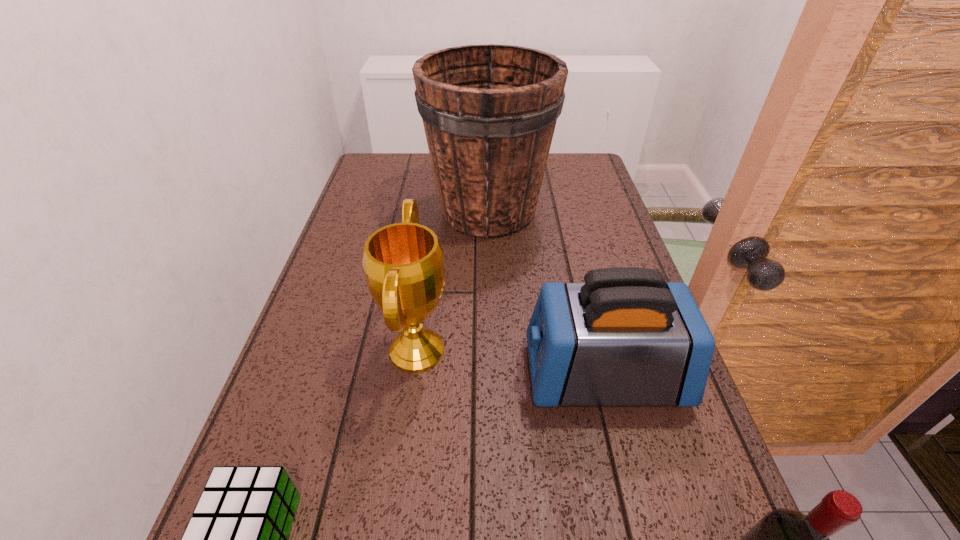
Locate an element on the screen. Image resolution: width=960 pixels, height=540 pixels. object located in the right edge section of the desktop is located at coordinates (626, 337).

Locate an element on the screen. vacant space at the left edge of the desktop is located at coordinates (396, 212).

Locate an element on the screen. Image resolution: width=960 pixels, height=540 pixels. vacant space at the right edge of the desktop is located at coordinates (646, 408).

Where is `free space at the far left corner of the desktop`? The image size is (960, 540). free space at the far left corner of the desktop is located at coordinates [407, 177].

Image resolution: width=960 pixels, height=540 pixels. In the image, there is a desktop. What are the coordinates of `free space at the far right corner` in the screenshot? It's located at (564, 175).

You are a GUI agent. You are given a task and a screenshot of the screen. Output one action in this format:
    pyautogui.click(x=<x>, y=<y>)
    Task: Click on the empty space between the toaster and the award
    The height and width of the screenshot is (540, 960).
    Given the screenshot: What is the action you would take?
    pyautogui.click(x=511, y=363)

Locate an element on the screen. This screenshot has width=960, height=540. object that is the third closest one to the shortest object is located at coordinates (784, 539).

This screenshot has height=540, width=960. What are the coordinates of `object that ranks as the closest to the award` in the screenshot? It's located at (626, 337).